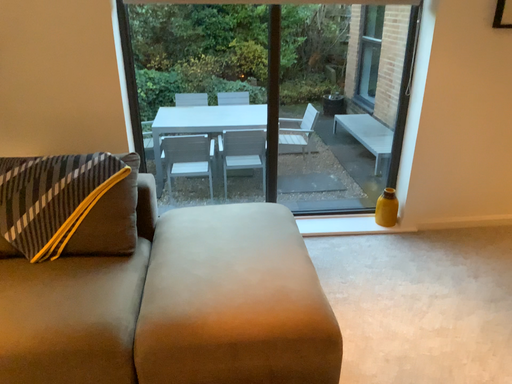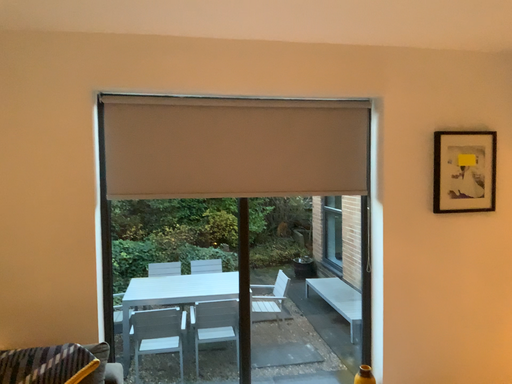
Question: Which way did the camera rotate in the video?

Choices:
 (A) rotated downward
 (B) rotated upward

Answer: (B)